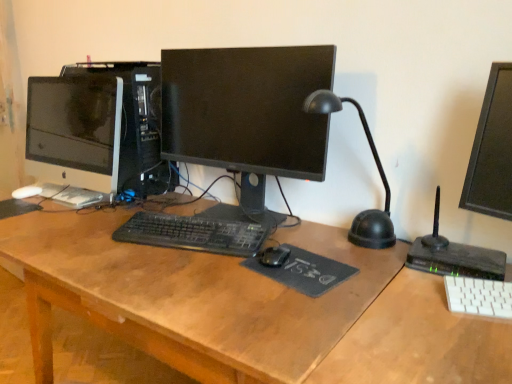
Question: Considering the relative positions of black plastic computer tower at center and black fabric mousepad at center, marked as the 2th mousepad in a top-to-bottom arrangement, in the image provided, is black plastic computer tower at center to the left of black fabric mousepad at center, marked as the 2th mousepad in a top-to-bottom arrangement, from the viewer's perspective?

Choices:
 (A) yes
 (B) no

Answer: (A)

Question: Is black plastic computer tower at center facing towards black fabric mousepad at center, which is the first mousepad in right-to-left order?

Choices:
 (A) yes
 (B) no

Answer: (B)

Question: Does black plastic computer tower at center have a smaller size compared to black fabric mousepad at center, which is the first mousepad in right-to-left order?

Choices:
 (A) no
 (B) yes

Answer: (A)

Question: Does black plastic computer tower at center have a lesser height compared to black fabric mousepad at center, the 1th mousepad positioned from the bottom?

Choices:
 (A) yes
 (B) no

Answer: (B)

Question: From the image's perspective, does black plastic computer tower at center appear lower than black fabric mousepad at center, which appears as the 1th mousepad when viewed from the front?

Choices:
 (A) no
 (B) yes

Answer: (A)

Question: Considering the positions of point (9, 203) and point (170, 183), is point (9, 203) closer or farther from the camera than point (170, 183)?

Choices:
 (A) closer
 (B) farther

Answer: (A)

Question: Considering their positions, is black rubber mousepad at center, which appears as the 2th mousepad when viewed from the right, located in front of or behind black plastic computer tower at center?

Choices:
 (A) behind
 (B) front

Answer: (B)

Question: Looking at their shapes, would you say black rubber mousepad at center, which ranks as the first mousepad in back-to-front order, is wider or thinner than black plastic computer tower at center?

Choices:
 (A) thin
 (B) wide

Answer: (A)

Question: Is black rubber mousepad at center, which appears as the 1th mousepad when viewed from the left, inside or outside of black plastic computer tower at center?

Choices:
 (A) inside
 (B) outside

Answer: (B)

Question: In terms of height, does wooden desk at center look taller or shorter compared to black glossy monitor at center, the 1th computer monitor viewed from the right?

Choices:
 (A) tall
 (B) short

Answer: (A)

Question: From a real-world perspective, is wooden desk at center above or below black glossy monitor at center, the 2th computer monitor viewed from the left?

Choices:
 (A) below
 (B) above

Answer: (A)

Question: From the image's perspective, is wooden desk at center located above or below black glossy monitor at center, the 2th computer monitor viewed from the left?

Choices:
 (A) below
 (B) above

Answer: (A)

Question: Would you say wooden desk at center is to the left or to the right of black glossy monitor at center, the 1th computer monitor viewed from the right, in the picture?

Choices:
 (A) left
 (B) right

Answer: (A)

Question: In terms of size, does black matte keyboard at center, the 1th computer keyboard when ordered from top to bottom, appear bigger or smaller than wooden desk at center?

Choices:
 (A) small
 (B) big

Answer: (A)

Question: Considering their positions, is black matte keyboard at center, the 1th computer keyboard when ordered from back to front, located in front of or behind wooden desk at center?

Choices:
 (A) behind
 (B) front

Answer: (A)